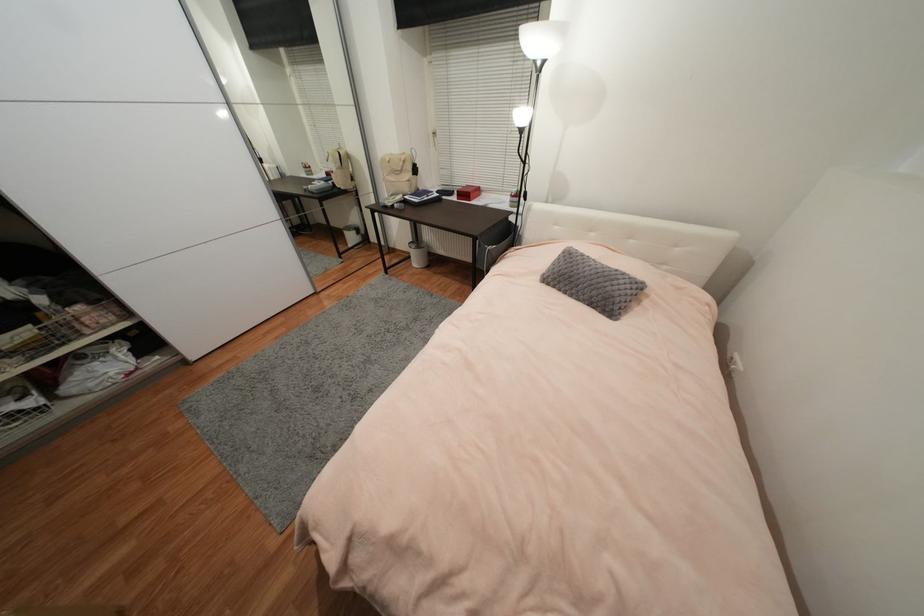
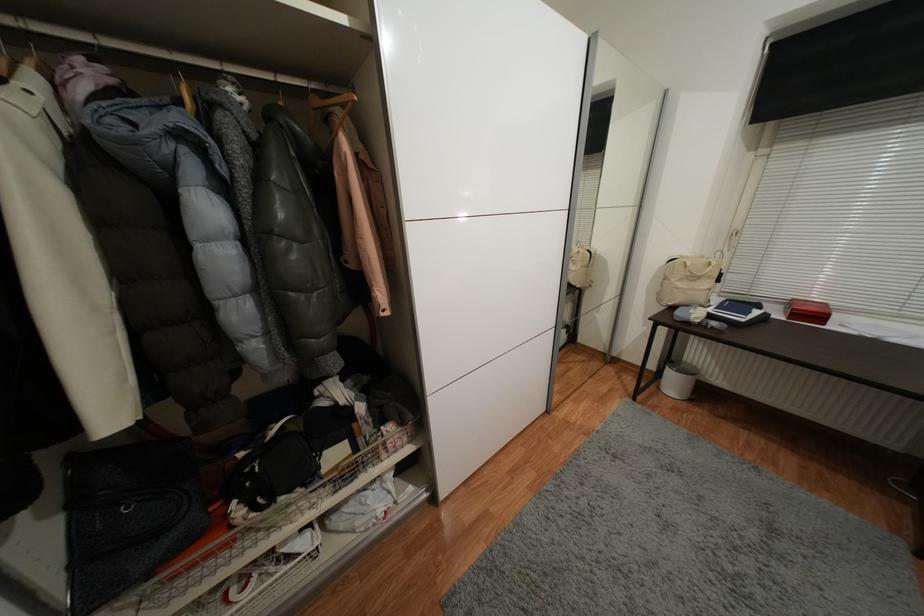
Question: The images are taken continuously from a first-person perspective. In which direction are you moving?

Choices:
 (A) Left
 (B) Right
 (C) Forward
 (D) Backward

Answer: (A)